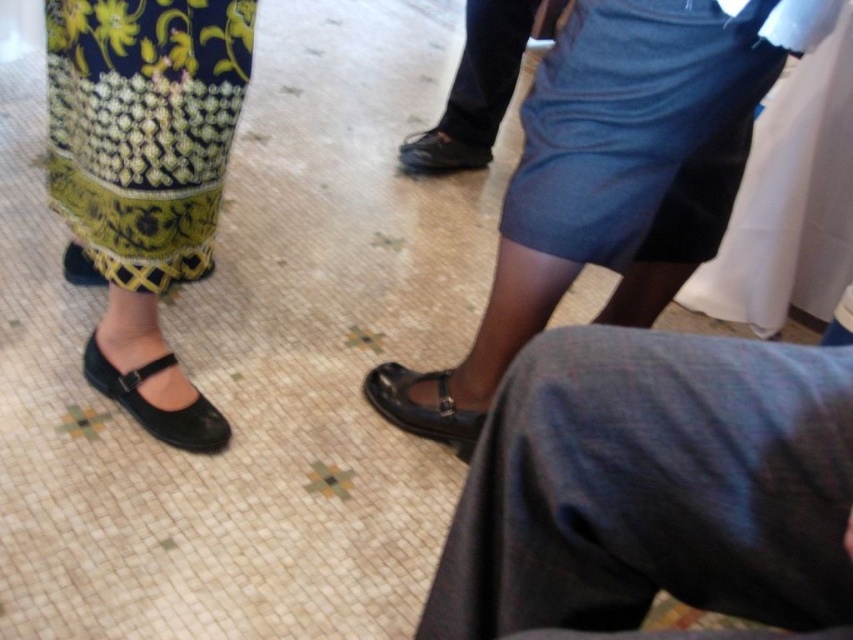
You are standing at the point marked as point (653, 492) in the image. Looking around, you see dark blue fabric pants at lower right. What is the nearest object to your current position?

The nearest object to point (653, 492) is the dark blue fabric pants at lower right as it is located at the lower right position closest to the marked point.

You are a photographer setting up for a shoot and need to ensure that the dark blue fabric pants at lower right and the black leather sandal at lower left are in focus. Given that your camera can only focus on objects within a 25 inch range, will both items be in focus?

The dark blue fabric pants at lower right is 30.09 inches away from the black leather sandal at lower left. Since the distance between them exceeds the 25 inch focus range, they cannot both be in focus simultaneously.

You are standing in the scene and want to move from the point closer to you to the farther point. Which path would you take to reach from point (809, 429) to point (112, 266)?

The path from point (809, 429) to point (112, 266) would involve moving diagonally towards the upper left direction since point (112, 266) is farther away from the viewer compared to point (809, 429).